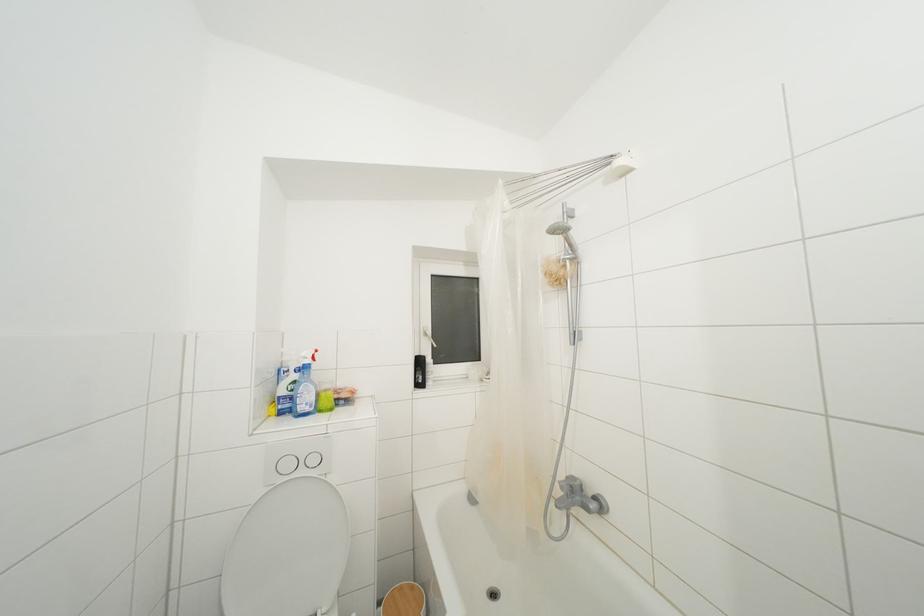
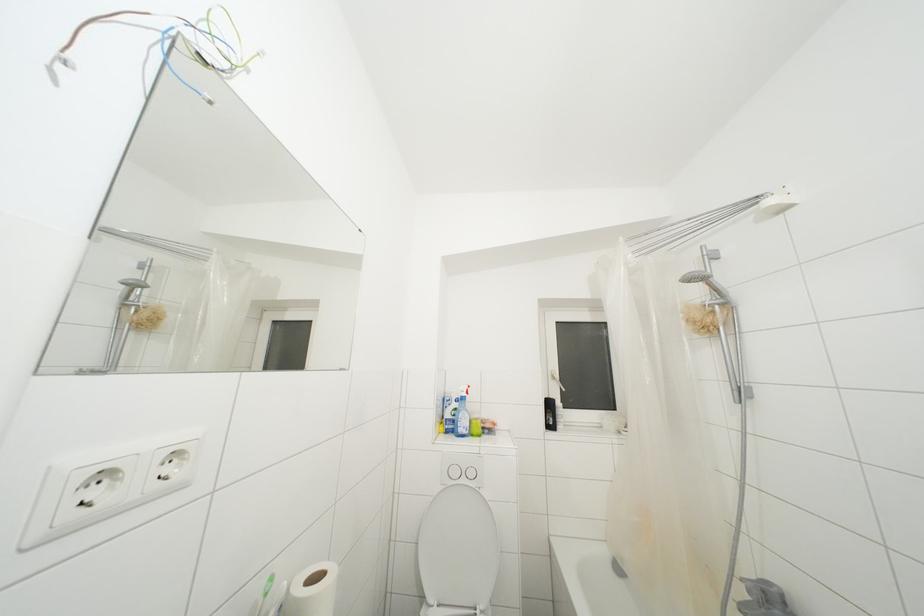
Question: The camera is either moving clockwise (left) or counter-clockwise (right) around the object. The first image is from the beginning of the video and the second image is from the end. Is the camera moving left or right when shooting the video?

Choices:
 (A) Left
 (B) Right

Answer: (B)